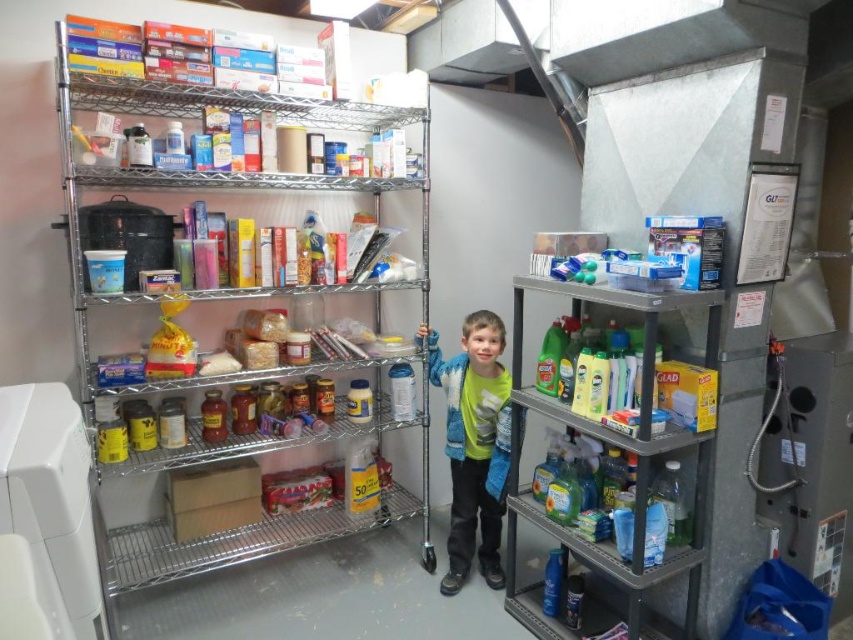
You are a volunteer organizing items in the storage area. You need to place a new box of cereal. The box is 15 cm tall. There is a spot at point A marked at coordinates (228, 336). Can you determine if the space at point A is suitable for placing the cereal box based on the height available?

The space at point A is part of the metallic silver shelves at left, which are stocked with items like boxes of cereal. Since the existing cereal boxes are taller than 15 cm, the space may not be suitable unless there is enough vertical clearance. However, without specific height measurements, it is recommended to check the available space physically.

You are organizing items in a storage area. You have a large box that needs to be placed on one of the metallic silver shelves at left or the metallic silver shelves at upper left. Based on their sizes, which shelf should you choose to ensure the box fits properly?

The metallic silver shelves at left has a larger size compared to metallic silver shelves at upper left, so you should choose the metallic silver shelves at left to ensure the box fits properly.

You are organizing items in the storage area and need to place a new box that requires a tall space. Which object between the gray plastic shelf at right and the blue fleece jacket at center would be suitable for placing the box?

The gray plastic shelf at right is taller than the blue fleece jacket at center, so the gray plastic shelf at right would be suitable for placing the box.